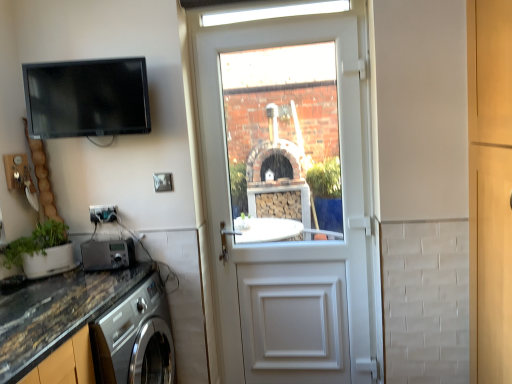
Identify the location of free space in front of metallic silver radio at lower left, placed as the 1th appliance when sorted from bottom to top. The image size is (512, 384). point(106,276).